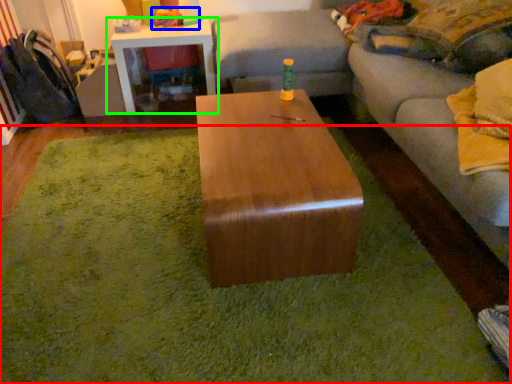
Question: Considering the real-world distances, which object is farthest from mat (highlighted by a red box)? toy (highlighted by a blue box) or table (highlighted by a green box)?

Choices:
 (A) toy
 (B) table

Answer: (A)